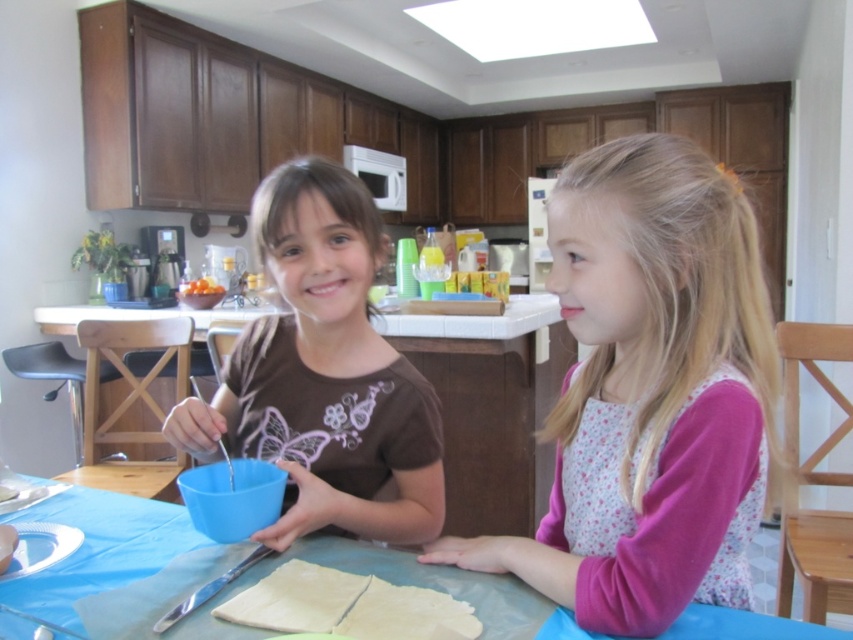
Question: Is floral fabric dress at center below blue plastic table at center?

Choices:
 (A) no
 (B) yes

Answer: (A)

Question: Which point is farther to the camera?

Choices:
 (A) click(x=102, y=563)
 (B) click(x=198, y=284)
 (C) click(x=260, y=397)

Answer: (B)

Question: Which of these objects is positioned closest to the blue plastic bowl at center?

Choices:
 (A) floral fabric dress at center
 (B) matte brown shirt at center
 (C) blue plastic table at center

Answer: (B)

Question: Is matte brown shirt at center wider than blue plastic table at center?

Choices:
 (A) no
 (B) yes

Answer: (A)

Question: Where is blue plastic bowl at center located in relation to blue plastic table at center in the image?

Choices:
 (A) left
 (B) right

Answer: (B)

Question: Which object appears closest to the camera in this image?

Choices:
 (A) orange matte bowl at center
 (B) matte brown shirt at center
 (C) floral fabric dress at center
 (D) blue plastic bowl at center

Answer: (C)